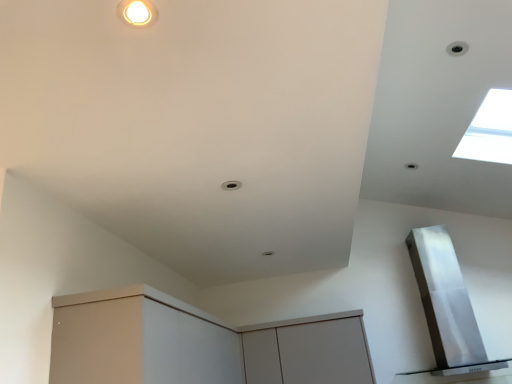
Question: Can you confirm if transparent glass window at upper right is wider than satin silver exhaust hood at upper right?

Choices:
 (A) yes
 (B) no

Answer: (B)

Question: From a real-world perspective, is transparent glass window at upper right positioned over satin silver exhaust hood at upper right based on gravity?

Choices:
 (A) no
 (B) yes

Answer: (B)

Question: Is transparent glass window at upper right with satin silver exhaust hood at upper right?

Choices:
 (A) no
 (B) yes

Answer: (A)

Question: Is transparent glass window at upper right oriented away from satin silver exhaust hood at upper right?

Choices:
 (A) no
 (B) yes

Answer: (A)

Question: Is transparent glass window at upper right far away from satin silver exhaust hood at upper right?

Choices:
 (A) yes
 (B) no

Answer: (A)

Question: Does transparent glass window at upper right have a greater height compared to satin silver exhaust hood at upper right?

Choices:
 (A) yes
 (B) no

Answer: (B)

Question: Can you confirm if matte white cabinet at lower left, marked as the second cabinetry in a right-to-left arrangement, is thinner than matte gray cabinet at center, positioned as the 1th cabinetry in right-to-left order?

Choices:
 (A) no
 (B) yes

Answer: (A)

Question: Can you confirm if matte white cabinet at lower left, marked as the second cabinetry in a right-to-left arrangement, is bigger than matte gray cabinet at center, which is the second cabinetry in left-to-right order?

Choices:
 (A) yes
 (B) no

Answer: (A)

Question: Would you consider matte white cabinet at lower left, acting as the 1th cabinetry starting from the left, to be distant from matte gray cabinet at center, which is the second cabinetry in left-to-right order?

Choices:
 (A) no
 (B) yes

Answer: (A)

Question: Considering the relative positions of matte white cabinet at lower left, acting as the 1th cabinetry starting from the left, and matte gray cabinet at center, positioned as the 1th cabinetry in right-to-left order, in the image provided, is matte white cabinet at lower left, acting as the 1th cabinetry starting from the left, to the left of matte gray cabinet at center, positioned as the 1th cabinetry in right-to-left order, from the viewer's perspective?

Choices:
 (A) no
 (B) yes

Answer: (B)

Question: Is matte white cabinet at lower left, marked as the second cabinetry in a right-to-left arrangement, aimed at matte gray cabinet at center, positioned as the 1th cabinetry in right-to-left order?

Choices:
 (A) no
 (B) yes

Answer: (A)

Question: Is matte white cabinet at lower left, acting as the 1th cabinetry starting from the left, further to camera compared to matte gray cabinet at center, which is the second cabinetry in left-to-right order?

Choices:
 (A) no
 (B) yes

Answer: (A)

Question: Is matte white cabinet at lower left, acting as the 1th cabinetry starting from the left, at the back of transparent glass window at upper right?

Choices:
 (A) no
 (B) yes

Answer: (A)